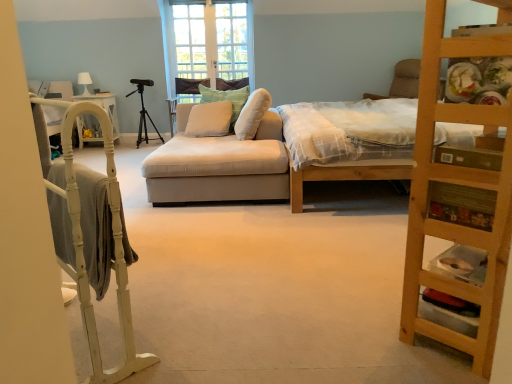
Image resolution: width=512 pixels, height=384 pixels. I want to click on unoccupied space behind white painted wood bunk bed at left, so click(165, 273).